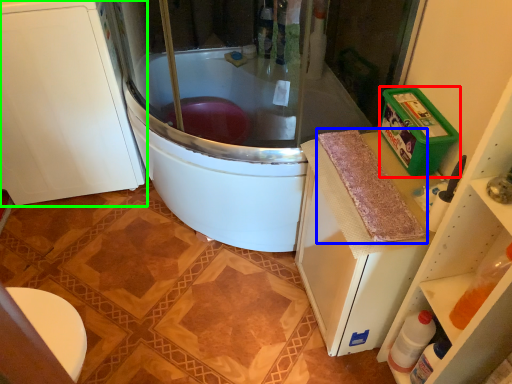
Question: Considering the real-world distances, which object is closest to appliance (highlighted by a red box)? material (highlighted by a blue box) or cabinetry (highlighted by a green box).

Choices:
 (A) material
 (B) cabinetry

Answer: (A)